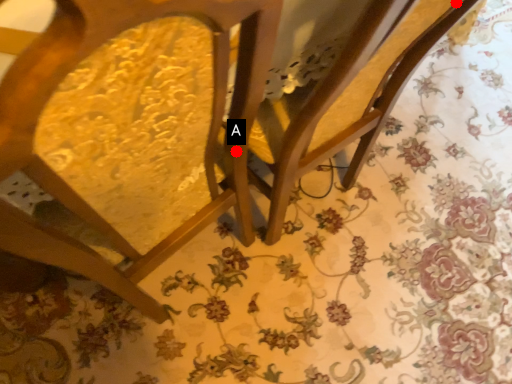
Question: Two points are circled on the image, labeled by A and B beside each circle. Which point is further to the camera?

Choices:
 (A) A is further
 (B) B is further

Answer: (A)